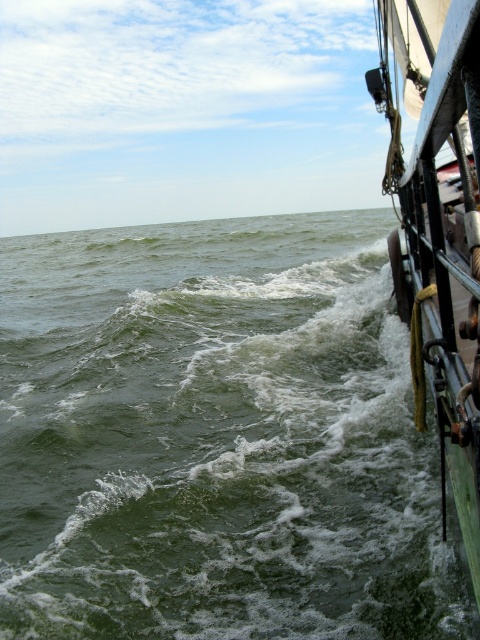
In the scene shown: You are an observer on the green matte sailboat at right. Looking down, you notice the green frothy water at lower left. Which object appears taller from your viewpoint?

The green matte sailboat at right appears taller than the green frothy water at lower left because the green frothy water at lower left is shorter than green matte sailboat at right.

You are standing on the boat and want to avoid stepping into the green frothy water. Which direction should you move to stay clear of the green frothy water at lower left located at point (216,436)?

The green frothy water at lower left is located at point (216,436), so you should move away from that point to avoid stepping into it.

You are an observer on the green matte sailboat at right. You notice the green frothy water at lower left. Which object has a wider width from your perspective?

The green matte sailboat at right has a wider width compared to the green frothy water at lower left.